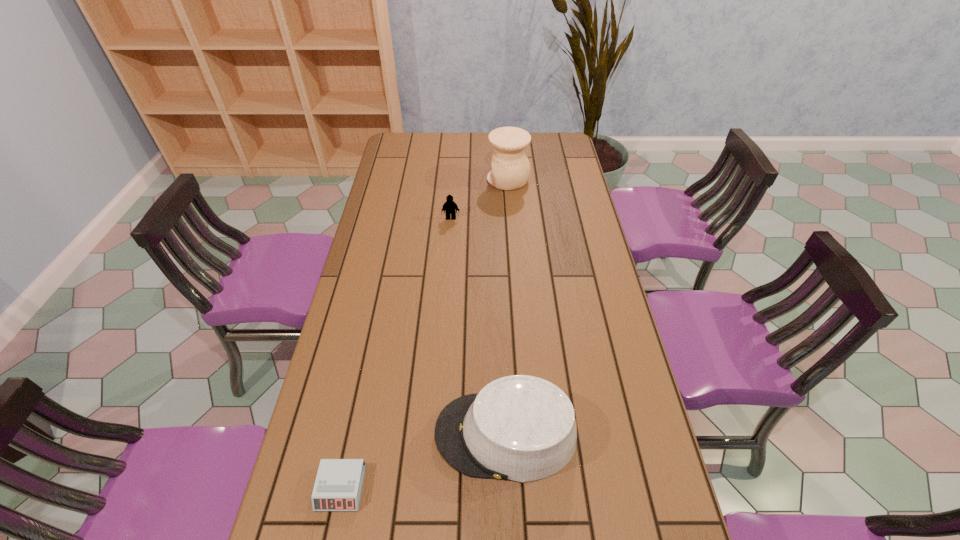
Locate an element on the screen. This screenshot has width=960, height=540. free spot between the second tallest object and the third nearest object is located at coordinates (478, 326).

Image resolution: width=960 pixels, height=540 pixels. I want to click on free area in between the second tallest object and the farthest object, so click(507, 307).

Locate an element on the screen. The image size is (960, 540). free spot between the tallest object and the third shortest object is located at coordinates (507, 307).

Where is `vacant region between the third tallest object and the pottery`? Image resolution: width=960 pixels, height=540 pixels. vacant region between the third tallest object and the pottery is located at coordinates (480, 199).

At what (x,y) coordinates should I click in order to perform the action: click on free spot between the second farthest object and the tallest object. Please return your answer as a coordinate pair (x, y). This screenshot has width=960, height=540. Looking at the image, I should click on (480, 199).

This screenshot has width=960, height=540. I want to click on empty space that is in between the third shortest object and the pottery, so click(507, 307).

Image resolution: width=960 pixels, height=540 pixels. I want to click on empty space between the Lego and the leftmost object, so click(396, 353).

Locate an element on the screen. This screenshot has height=540, width=960. empty location between the third shortest object and the shortest object is located at coordinates (423, 461).

At what (x,y) coordinates should I click in order to perform the action: click on unoccupied position between the third shortest object and the farthest object. Please return your answer as a coordinate pair (x, y). Image resolution: width=960 pixels, height=540 pixels. Looking at the image, I should click on (507, 307).

Select which object appears as the third closest to the leftmost object. Please provide its 2D coordinates. Your answer should be formatted as a tuple, i.e. [(x, y)], where the tuple contains the x and y coordinates of a point satisfying the conditions above.

[(510, 166)]